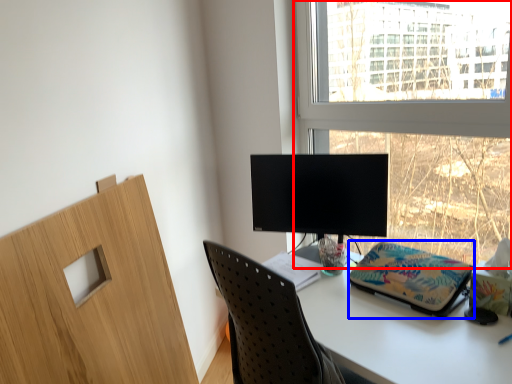
Question: Which of the following is the farthest to the observer, window (highlighted by a red box) or stationery (highlighted by a blue box)?

Choices:
 (A) window
 (B) stationery

Answer: (B)